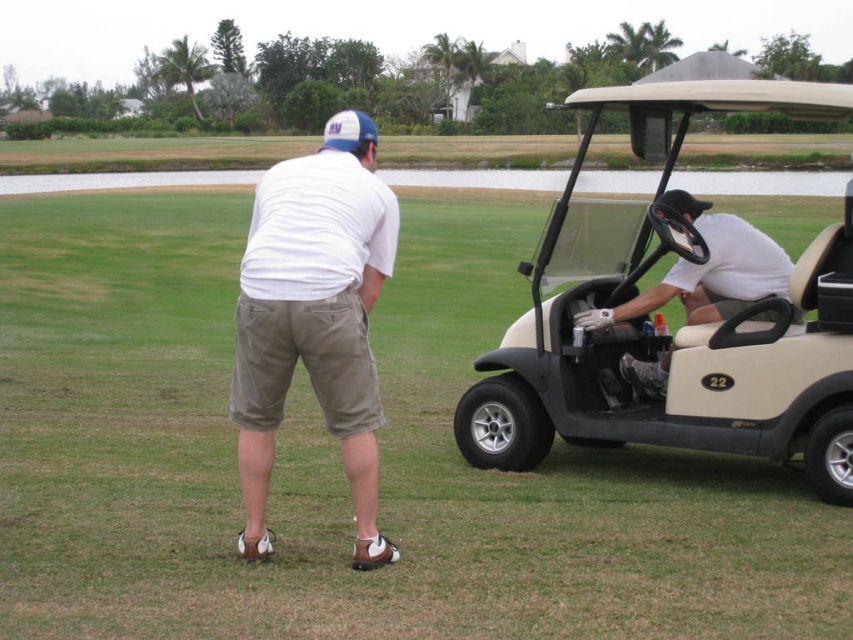
Is white matte golf cart at center taller than black matte baseball hat at right?

Yes.

Looking at this image, is white matte golf cart at center positioned behind black matte baseball hat at right?

That is True.

Does point (711, 216) come behind point (685, 211)?

Yes, point (711, 216) is behind point (685, 211).

Find the location of a particular element. white matte golf cart at center is located at coordinates (711, 276).

Is white cotton shirt at center shorter than blue fabric baseball cap at upper center?

Correct, white cotton shirt at center is not as tall as blue fabric baseball cap at upper center.

Can you confirm if white cotton shirt at center is positioned to the right of blue fabric baseball cap at upper center?

Indeed, white cotton shirt at center is positioned on the right side of blue fabric baseball cap at upper center.

Is point (374, 374) closer to camera compared to point (323, 132)?

Yes.

Locate an element on the screen. white cotton shirt at center is located at coordinates (312, 324).

Is beige matte golf cart at right shorter than white matte golf cart at center?

In fact, beige matte golf cart at right may be taller than white matte golf cart at center.

Between point (846, 356) and point (788, 262), which one is positioned behind?

Positioned behind is point (788, 262).

At what (x,y) coordinates should I click in order to perform the action: click on beige matte golf cart at right. Please return your answer as a coordinate pair (x, y). Looking at the image, I should click on (680, 328).